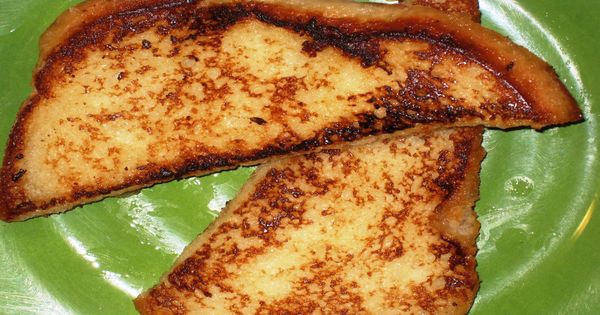
Identify the location of scratches on plate. Image resolution: width=600 pixels, height=315 pixels. (14, 26), (517, 153).